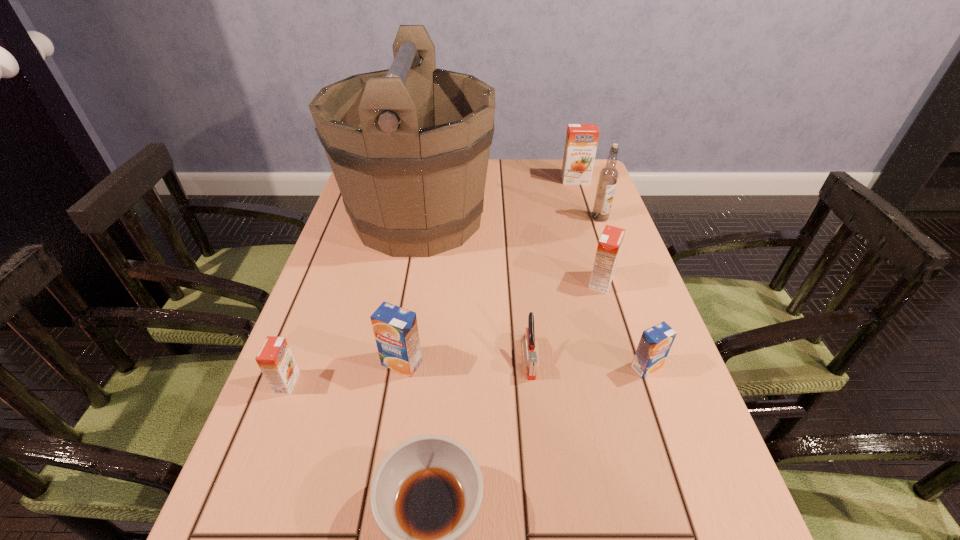
Locate an element on the screen. vacant space located 0.130m on the handle side of the stapler is located at coordinates (539, 442).

Locate an element on the screen. The width and height of the screenshot is (960, 540). bucket at the far edge is located at coordinates (409, 146).

You are a GUI agent. You are given a task and a screenshot of the screen. Output one action in this format:
    pyautogui.click(x=<x>, y=<y>)
    Task: Click on the orange juice that is at the far edge
    
    Given the screenshot: What is the action you would take?
    pyautogui.click(x=581, y=142)

This screenshot has width=960, height=540. Find the location of `bucket located in the left edge section of the desktop`. bucket located in the left edge section of the desktop is located at coordinates (409, 146).

Identify the location of orange juice present at the left edge. This screenshot has height=540, width=960. (275, 359).

The image size is (960, 540). In order to click on vodka that is at the right edge in this screenshot , I will do `click(608, 176)`.

Identify the location of object that is at the far left corner. This screenshot has height=540, width=960. (409, 146).

At what (x,y) coordinates should I click in order to perform the action: click on object that is positioned at the far right corner. Please return your answer as a coordinate pair (x, y). Image resolution: width=960 pixels, height=540 pixels. Looking at the image, I should click on (581, 142).

Image resolution: width=960 pixels, height=540 pixels. Find the location of `vacant space at the far edge of the desktop`. vacant space at the far edge of the desktop is located at coordinates (514, 192).

The height and width of the screenshot is (540, 960). In order to click on free space at the left edge of the desktop in this screenshot , I will do `click(311, 521)`.